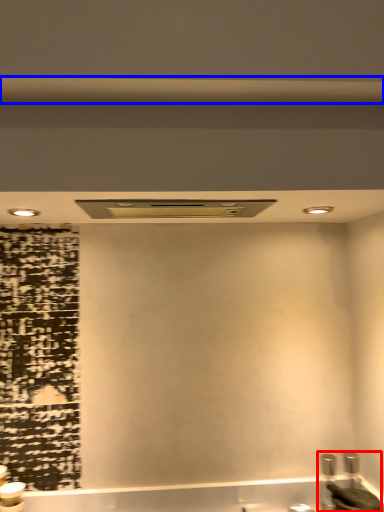
Question: Which point is closer to the camera, sink (highlighted by a red box) or beam (highlighted by a blue box)?

Choices:
 (A) sink
 (B) beam

Answer: (B)